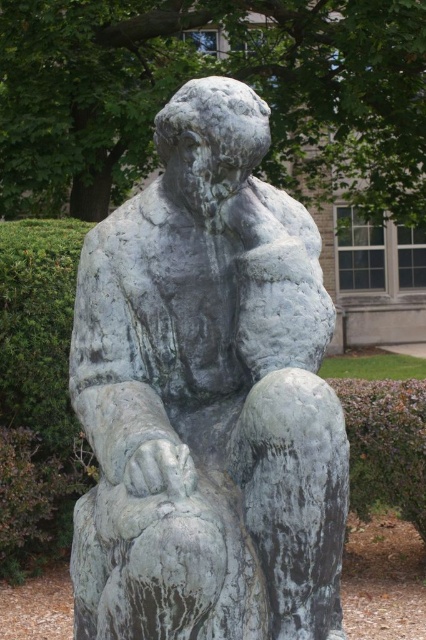
Question: Which point appears closest to the camera in this image?

Choices:
 (A) (229, 147)
 (B) (396, 435)

Answer: (A)

Question: Which point is closer to the camera?

Choices:
 (A) green leafy hedge at lower right
 (B) green patina stone statue at center

Answer: (B)

Question: Does green patina stone statue at center have a lesser width compared to green leafy hedge at lower right?

Choices:
 (A) yes
 (B) no

Answer: (B)

Question: In this image, where is green patina stone statue at center located relative to green leafy hedge at lower right?

Choices:
 (A) right
 (B) left

Answer: (B)

Question: Is green patina stone statue at center below green leafy hedge at lower right?

Choices:
 (A) yes
 (B) no

Answer: (B)